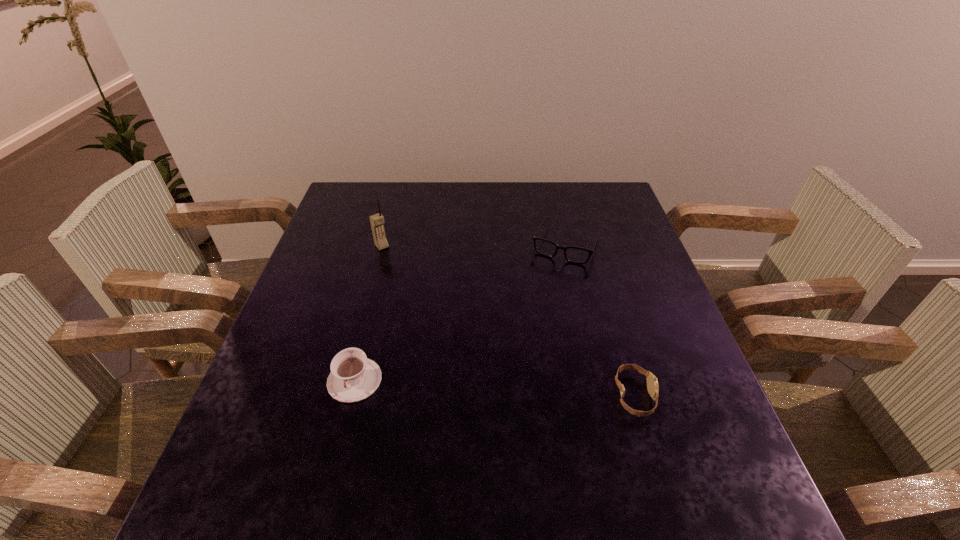
This screenshot has width=960, height=540. I want to click on teacup, so click(354, 377).

Locate an element on the screen. The width and height of the screenshot is (960, 540). the shortest object is located at coordinates (652, 383).

The width and height of the screenshot is (960, 540). Identify the location of spectacles. (577, 255).

Identify the location of cellular telephone. (377, 221).

Find the location of `vacant space located on the face of the watch`. vacant space located on the face of the watch is located at coordinates 693,396.

The width and height of the screenshot is (960, 540). In order to click on vacant space situated on the front-facing side of the spectacles in this screenshot , I will do `click(541, 298)`.

Find the location of a particular element. This screenshot has width=960, height=540. free space located on the front-facing side of the spectacles is located at coordinates (533, 318).

Find the location of `vacant region located on the front-facing side of the spectacles`. vacant region located on the front-facing side of the spectacles is located at coordinates (533, 318).

The image size is (960, 540). I want to click on vacant space situated on the front of the cellular telephone, where the keypad is located, so click(x=403, y=272).

At what (x,y) coordinates should I click in order to perform the action: click on blank area located on the front of the cellular telephone, where the keypad is located. Please return your answer as a coordinate pair (x, y). Image resolution: width=960 pixels, height=540 pixels. Looking at the image, I should click on (396, 261).